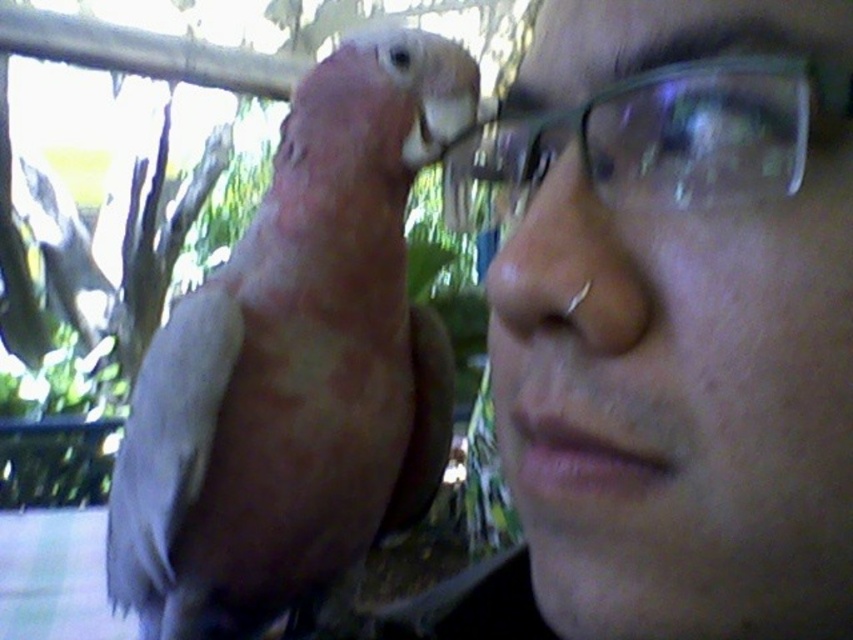
You are a photographer holding a camera and want to take a closeup shot of the clear glass glasses at upper right. The camera lens is currently 8.53 inches away from the glasses. Is this distance sufficient to capture a clear, non blurred image?

The clear glass glasses at upper right and viewer are 8.53 inches apart from each other. This distance may be sufficient for a clear shot, but it depends on the camera settings and lens quality. Ensure proper focus and lighting to avoid blur.

Looking at this image, you are a photographer trying to capture a close shot of the bird. You have two pairs of glasses in the scene, the clear glass glasses at upper right and the clear plastic glasses at upper center. Which pair of glasses is taller and might interfere with your focus if you don not adjust your camera settings?

The clear glass glasses at upper right is much taller than the clear plastic glasses at upper center, so it might interfere with your focus if you do not adjust your camera settings.